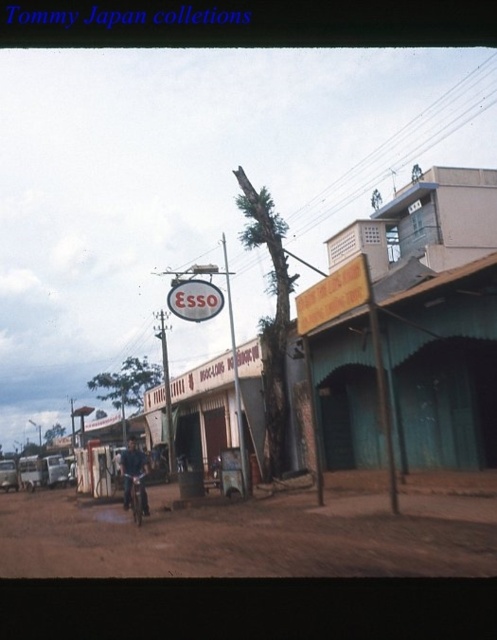
Question: Is matte gray building at center below dark blue fabric jacket at center?

Choices:
 (A) yes
 (B) no

Answer: (B)

Question: Estimate the real-world distances between objects in this image. Which object is farther from the smooth wooden pole at center?

Choices:
 (A) matte gray building at center
 (B) dark blue fabric jacket at center
 (C) brown dirt track at center
 (D) metallic silver bicycle at center

Answer: (B)

Question: Is smooth wooden pole at center to the left of dark blue fabric jacket at center from the viewer's perspective?

Choices:
 (A) yes
 (B) no

Answer: (B)

Question: Does smooth wooden pole at center have a smaller size compared to dark blue fabric jacket at center?

Choices:
 (A) yes
 (B) no

Answer: (B)

Question: Which object is positioned closest to the dark blue fabric jacket at center?

Choices:
 (A) brown dirt track at center
 (B) matte gray building at center
 (C) metallic silver bicycle at center

Answer: (C)

Question: Which object is farther from the camera taking this photo?

Choices:
 (A) brown dirt track at center
 (B) metallic silver bicycle at center
 (C) smooth wooden pole at center
 (D) dark blue fabric jacket at center

Answer: (C)